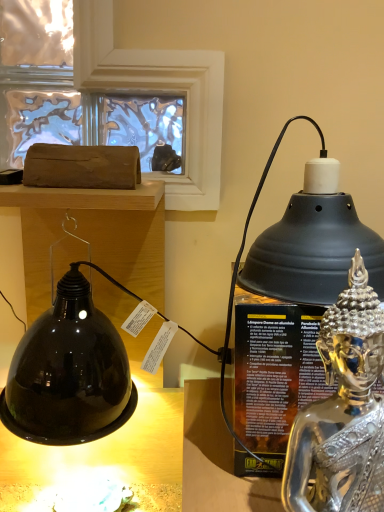
Question: Is matte brown log at upper left to the left or to the right of shiny metallic oil lamp at right in the image?

Choices:
 (A) right
 (B) left

Answer: (B)

Question: From the image's perspective, relative to shiny metallic oil lamp at right, is matte brown log at upper left above or below?

Choices:
 (A) above
 (B) below

Answer: (A)

Question: Which of these objects is positioned closest to the silver metallic statue at right?

Choices:
 (A) shiny metallic oil lamp at right
 (B) matte brown log at upper left

Answer: (A)

Question: Which of these objects is positioned farthest from the matte brown log at upper left?

Choices:
 (A) shiny metallic oil lamp at right
 (B) silver metallic statue at right

Answer: (B)